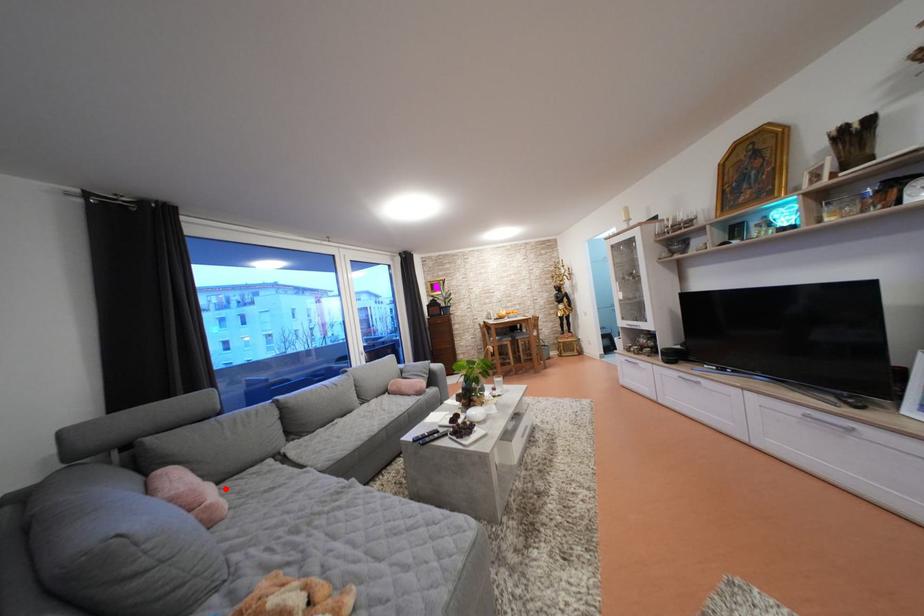
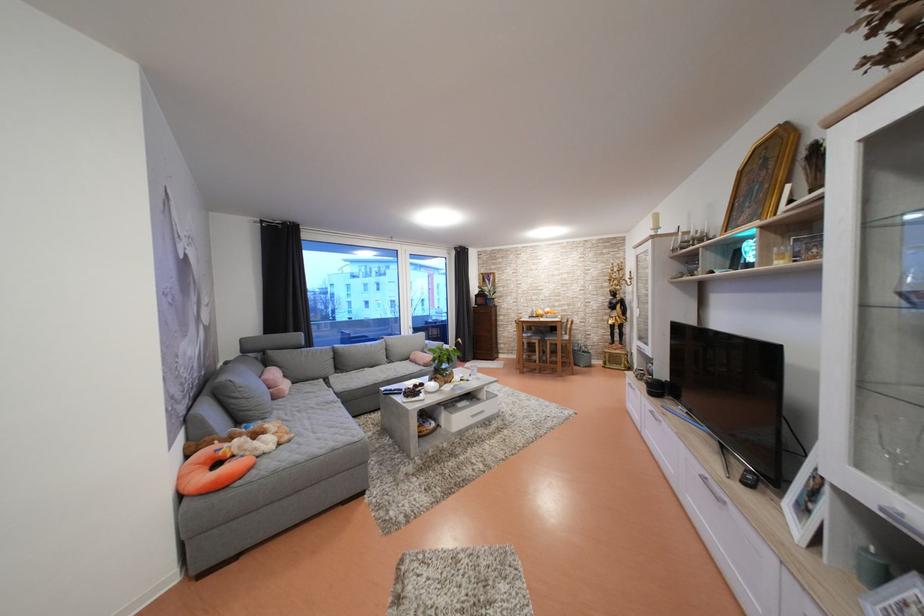
Question: I am providing you with two images of the same scene from different viewpoints. A red point is marked on the first image. Can you still see the location of the red point in image 2?

Choices:
 (A) Yes
 (B) No

Answer: (A)